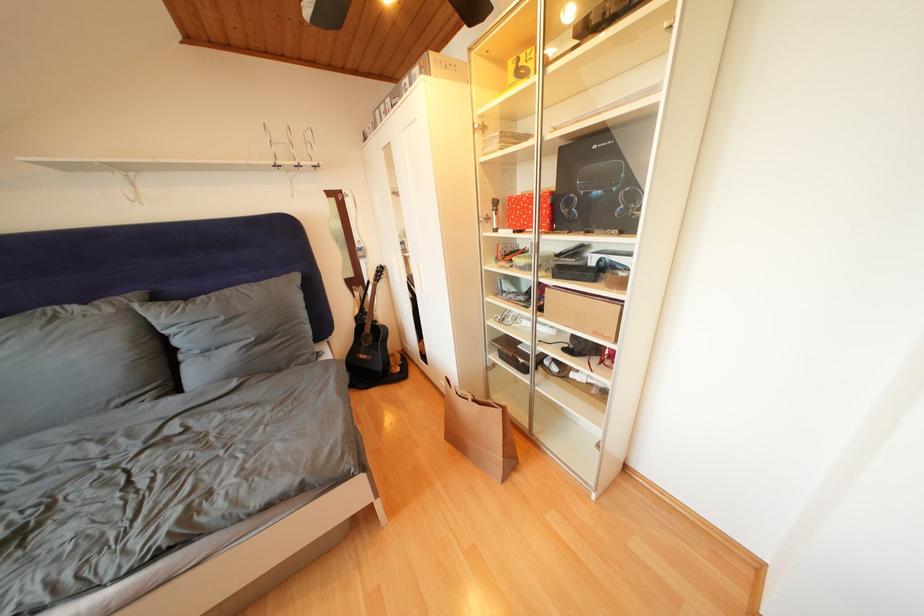
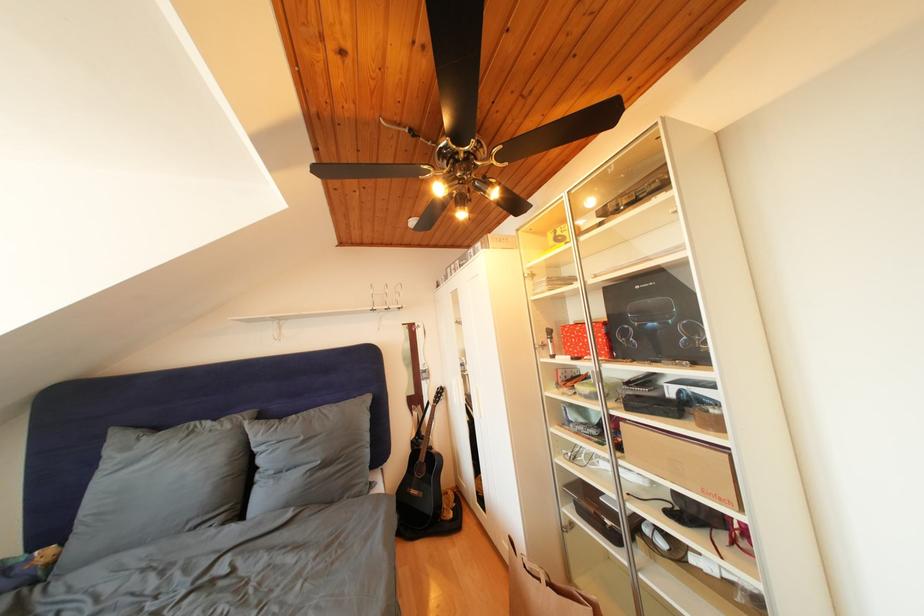
The point at (x=117, y=315) is marked in the first image. Where is the corresponding point in the second image?

(236, 432)